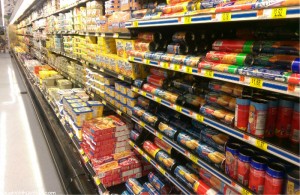
Image resolution: width=300 pixels, height=195 pixels. What are the coordinates of `floor drain` in the screenshot? It's located at (25, 92).